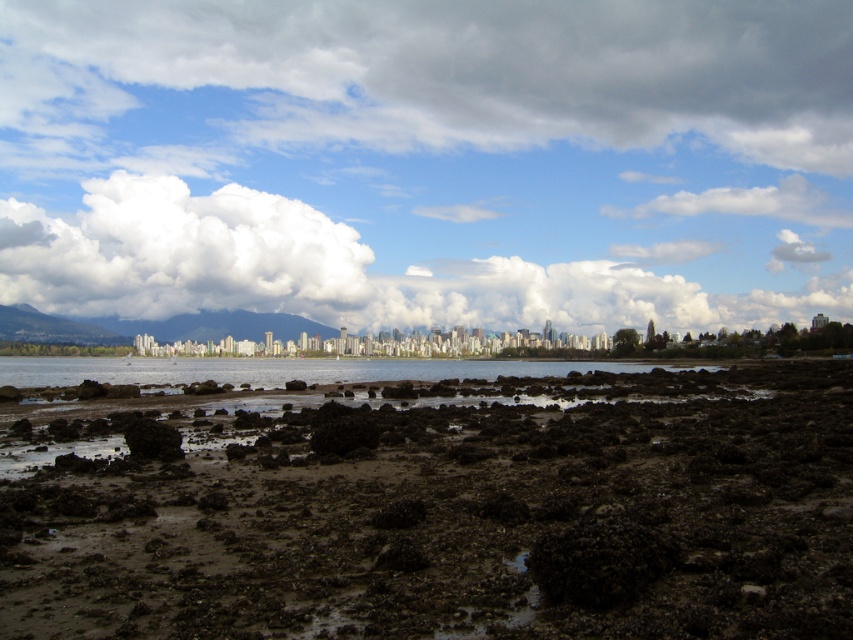
Between dull brown mud at center and white fluffy cloud at upper left, which one appears on the left side from the viewer's perspective?

Positioned to the left is white fluffy cloud at upper left.

Which is above, dull brown mud at center or white fluffy cloud at upper left?

Positioned higher is white fluffy cloud at upper left.

At what (x,y) coordinates should I click in order to perform the action: click on dull brown mud at center. Please return your answer as a coordinate pair (x, y). The width and height of the screenshot is (853, 640). Looking at the image, I should click on (442, 512).

The width and height of the screenshot is (853, 640). In order to click on dull brown mud at center in this screenshot , I will do `click(442, 512)`.

Measure the distance from dull brown mud at center to cloudy sky at upper center.

dull brown mud at center is 1189.45 feet from cloudy sky at upper center.

Does dull brown mud at center appear over cloudy sky at upper center?

No.

Is point (131, 412) positioned before point (247, 16)?

That is True.

The width and height of the screenshot is (853, 640). What are the coordinates of `dull brown mud at center` in the screenshot? It's located at (442, 512).

The height and width of the screenshot is (640, 853). I want to click on dull brown mud at center, so click(x=442, y=512).

Who is more forward, (641, 516) or (315, 371)?

Point (641, 516)

You are a GUI agent. You are given a task and a screenshot of the screen. Output one action in this format:
    pyautogui.click(x=<x>, y=<y>)
    Task: Click on the dull brown mud at center
    The width and height of the screenshot is (853, 640).
    Given the screenshot: What is the action you would take?
    pyautogui.click(x=442, y=512)